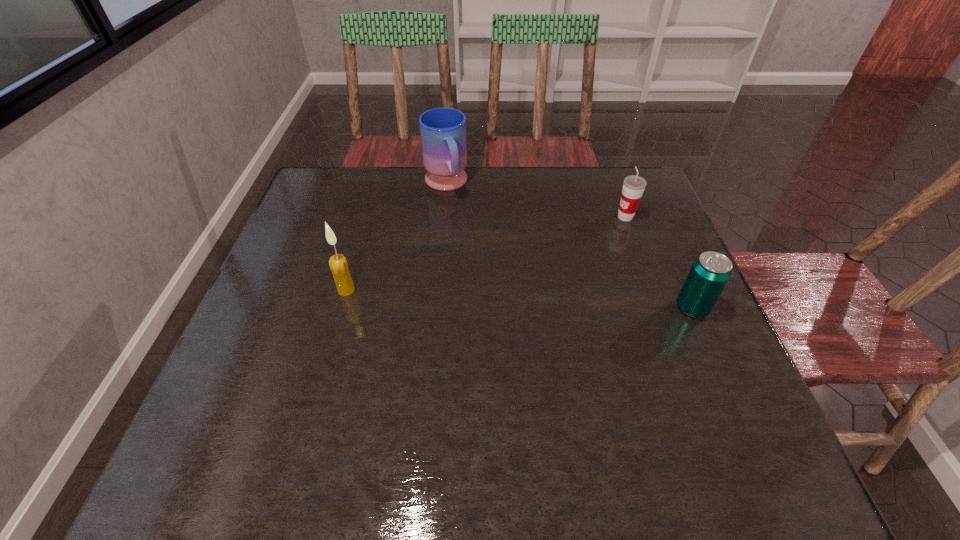
The height and width of the screenshot is (540, 960). What are the coordinates of `vacant space located on the side of the third nearest object with the logo` in the screenshot? It's located at (577, 244).

Where is `vacant space situated 0.170m on the side of the farthest object with the handle`? This screenshot has height=540, width=960. vacant space situated 0.170m on the side of the farthest object with the handle is located at coordinates (467, 240).

Find the location of a particular element. free location located on the side of the farthest object with the handle is located at coordinates (479, 268).

Find the location of a particular element. vacant position located on the side of the farthest object with the handle is located at coordinates (459, 222).

Where is `cup positioned at the far edge`? Image resolution: width=960 pixels, height=540 pixels. cup positioned at the far edge is located at coordinates (633, 185).

What are the coordinates of `mug located in the far edge section of the desktop` in the screenshot? It's located at (442, 130).

Where is `beer can that is at the right edge`? Image resolution: width=960 pixels, height=540 pixels. beer can that is at the right edge is located at coordinates (709, 274).

I want to click on cup located in the right edge section of the desktop, so click(x=633, y=185).

Locate an element on the screen. This screenshot has width=960, height=540. object that is at the far right corner is located at coordinates (633, 185).

In the image, there is a desktop. In order to click on vacant space at the far edge in this screenshot , I will do `click(545, 183)`.